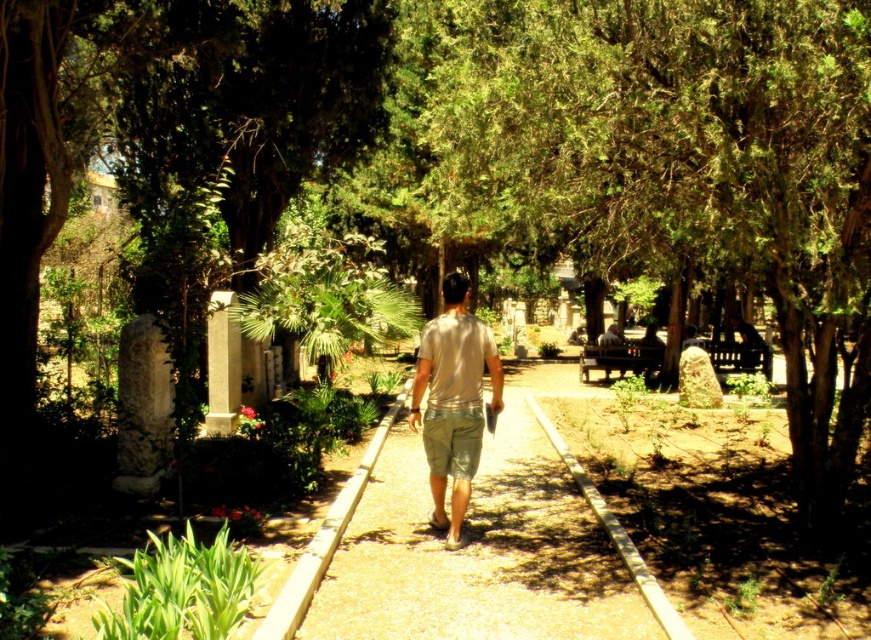
Question: Observing the image, what is the correct spatial positioning of smooth concrete path at center in reference to beige cotton shirt at center?

Choices:
 (A) above
 (B) below

Answer: (B)

Question: Can you confirm if smooth concrete path at center is positioned below beige cotton shirt at center?

Choices:
 (A) no
 (B) yes

Answer: (B)

Question: Which object appears farthest from the camera in this image?

Choices:
 (A) smooth concrete path at center
 (B) beige cotton shirt at center

Answer: (B)

Question: Which of the following is the closest to the observer?

Choices:
 (A) beige cotton shirt at center
 (B) smooth concrete path at center

Answer: (B)

Question: Is smooth concrete path at center positioned behind beige cotton shirt at center?

Choices:
 (A) no
 (B) yes

Answer: (A)

Question: Which point is closer to the camera taking this photo?

Choices:
 (A) (494, 385)
 (B) (660, 604)

Answer: (B)